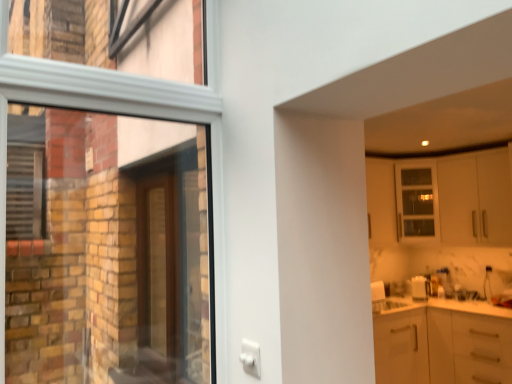
This screenshot has height=384, width=512. What do you see at coordinates (475, 198) in the screenshot? I see `white matte cabinet at upper right` at bounding box center [475, 198].

Where is `white matte cabinet at upper right`? Image resolution: width=512 pixels, height=384 pixels. white matte cabinet at upper right is located at coordinates (475, 198).

This screenshot has width=512, height=384. Describe the element at coordinates (159, 276) in the screenshot. I see `brown wooden door at left` at that location.

Locate an element on the screen. The image size is (512, 384). brown wooden door at left is located at coordinates (159, 276).

Locate an element on the screen. This screenshot has width=512, height=384. white matte cabinet at upper right is located at coordinates (475, 198).

Does white matte cabinet at upper right appear on the right side of brown wooden door at left?

Yes, white matte cabinet at upper right is to the right of brown wooden door at left.

Relative to brown wooden door at left, is white matte cabinet at upper right in front or behind?

Visually, white matte cabinet at upper right is located behind brown wooden door at left.

Does point (497, 199) appear closer or farther from the camera than point (166, 364)?

Point (497, 199) is farther from the camera than point (166, 364).

From the image's perspective, who appears lower, white matte cabinet at upper right or brown wooden door at left?

brown wooden door at left.

From a real-world perspective, which is physically above, white matte cabinet at upper right or brown wooden door at left?

In real-world perspective, white matte cabinet at upper right is above.

From the picture: Considering the relative sizes of white matte cabinet at upper right and brown wooden door at left in the image provided, is white matte cabinet at upper right thinner than brown wooden door at left?

No.

Is white matte cabinet at upper right shorter than brown wooden door at left?

Yes, white matte cabinet at upper right is shorter than brown wooden door at left.

Looking at the image, does white matte cabinet at upper right seem bigger or smaller compared to brown wooden door at left?

Considering their sizes, white matte cabinet at upper right takes up more space than brown wooden door at left.

Is brown wooden door at left completely or partially inside white matte cabinet at upper right?

No, brown wooden door at left is not surrounded by white matte cabinet at upper right.

From the picture: Are white matte cabinet at upper right and brown wooden door at left making contact?

No, white matte cabinet at upper right is not with brown wooden door at left.

Is white matte cabinet at upper right looking in the opposite direction of brown wooden door at left?

white matte cabinet at upper right is not turned away from brown wooden door at left.

What's the angular difference between white matte cabinet at upper right and brown wooden door at left's facing directions?

180 degrees separate the facing orientations of white matte cabinet at upper right and brown wooden door at left.

How much distance is there between white matte cabinet at upper right and brown wooden door at left?

white matte cabinet at upper right is 3.03 meters from brown wooden door at left.

Locate an element on the screen. This screenshot has width=512, height=384. cabinetry lying above the brown wooden door at left (from the image's perspective) is located at coordinates (475, 198).

Is brown wooden door at left to the right of white matte cabinet at upper right from the viewer's perspective?

In fact, brown wooden door at left is to the left of white matte cabinet at upper right.

Considering the relative positions of brown wooden door at left and white matte cabinet at upper right in the image provided, is brown wooden door at left behind white matte cabinet at upper right?

That is False.

Is point (139, 311) less distant than point (449, 190)?

Yes, it is.

From the image's perspective, is brown wooden door at left located above white matte cabinet at upper right?

No, from the image's perspective, brown wooden door at left is not over white matte cabinet at upper right.

From a real-world perspective, is brown wooden door at left under white matte cabinet at upper right?

Yes, from a real-world perspective, brown wooden door at left is under white matte cabinet at upper right.

Which of these two, brown wooden door at left or white matte cabinet at upper right, is wider?

white matte cabinet at upper right is wider.

Is brown wooden door at left shorter than white matte cabinet at upper right?

Incorrect, the height of brown wooden door at left does not fall short of that of white matte cabinet at upper right.

Considering the relative sizes of brown wooden door at left and white matte cabinet at upper right in the image provided, is brown wooden door at left smaller than white matte cabinet at upper right?

Correct, brown wooden door at left occupies less space than white matte cabinet at upper right.

Based on the photo, could white matte cabinet at upper right be considered to be inside brown wooden door at left?

Actually, white matte cabinet at upper right is outside brown wooden door at left.

Is brown wooden door at left not close to white matte cabinet at upper right?

Absolutely, brown wooden door at left is distant from white matte cabinet at upper right.

Could you tell me if brown wooden door at left is facing white matte cabinet at upper right?

Yes.

Can you tell me how much brown wooden door at left and white matte cabinet at upper right differ in facing direction?

The angle between the facing direction of brown wooden door at left and the facing direction of white matte cabinet at upper right is 180 degrees.

Measure the distance from brown wooden door at left to white matte cabinet at upper right.

A distance of 3.03 meters exists between brown wooden door at left and white matte cabinet at upper right.

The image size is (512, 384). In order to click on cabinetry behind the brown wooden door at left in this screenshot , I will do `click(475, 198)`.

Locate an element on the screen. cabinetry behind the brown wooden door at left is located at coordinates (475, 198).

The image size is (512, 384). Find the location of `cabinetry above the brown wooden door at left (from a real-world perspective)`. cabinetry above the brown wooden door at left (from a real-world perspective) is located at coordinates (475, 198).